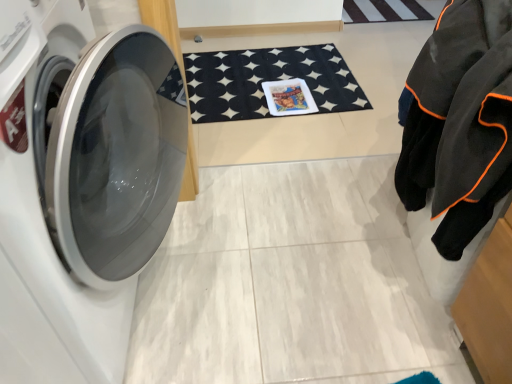
Image resolution: width=512 pixels, height=384 pixels. I want to click on black felt bath mat at center, so click(267, 81).

Measure the distance between point (465, 216) and camera.

A distance of 32.76 inches exists between point (465, 216) and camera.

Where is `black felt bath mat at center`? The image size is (512, 384). black felt bath mat at center is located at coordinates (267, 81).

Is black felt bath mat at center turned away from white glossy washing machine at left?

That's not correct — black felt bath mat at center is not looking away from white glossy washing machine at left.

Does point (236, 104) lie behind point (85, 185)?

Yes, point (236, 104) is farther from viewer.

Can you tell me how much black felt bath mat at center and white glossy washing machine at left differ in facing direction?

The angular difference between black felt bath mat at center and white glossy washing machine at left is 87.9 degrees.

From the image's perspective, which one is positioned lower, white glossy washing machine at left or black felt bath mat at center?

From the image's view, white glossy washing machine at left is below.

From the picture: Is white glossy washing machine at left not near black felt bath mat at center?

white glossy washing machine at left is far away from black felt bath mat at center.

Can you confirm if white glossy washing machine at left is positioned to the right of black felt bath mat at center?

In fact, white glossy washing machine at left is to the left of black felt bath mat at center.

Considering the positions of point (457, 42) and point (114, 88), is point (457, 42) closer or farther from the camera than point (114, 88)?

Clearly, point (457, 42) is closer to the camera than point (114, 88).

Is black fleece jacket at right positioned far away from white glossy washing machine at left?

No.

In the image, is black fleece jacket at right on the left side or the right side of white glossy washing machine at left?

From the image, it's evident that black fleece jacket at right is to the right of white glossy washing machine at left.

Is black fleece jacket at right situated inside white glossy washing machine at left or outside?

black fleece jacket at right is not enclosed by white glossy washing machine at left.

Does black felt bath mat at center have a lesser height compared to black fleece jacket at right?

Yes.

Is there a large distance between black felt bath mat at center and black fleece jacket at right?

Absolutely, black felt bath mat at center is distant from black fleece jacket at right.

Is black felt bath mat at center in front of or behind black fleece jacket at right in the image?

In the image, black felt bath mat at center appears behind black fleece jacket at right.

From a real-world perspective, is black fleece jacket at right positioned above or below black felt bath mat at center?

In terms of real-world spatial position, black fleece jacket at right is above black felt bath mat at center.

Between black fleece jacket at right and black felt bath mat at center, which one has larger width?

black felt bath mat at center is wider.

Looking at this image, which is more to the right, black fleece jacket at right or black felt bath mat at center?

Positioned to the right is black fleece jacket at right.

Is the surface of black fleece jacket at right in direct contact with black felt bath mat at center?

No, black fleece jacket at right is not beside black felt bath mat at center.

Consider the image. From a real-world perspective, who is located higher, white glossy washing machine at left or black fleece jacket at right?

black fleece jacket at right, from a real-world perspective.

Is point (118, 312) closer to camera compared to point (468, 155)?

No.

Is white glossy washing machine at left oriented towards black fleece jacket at right?

Yes, white glossy washing machine at left is aimed at black fleece jacket at right.

Which object is positioned more to the right, white glossy washing machine at left or black fleece jacket at right?

Positioned to the right is black fleece jacket at right.

Find the location of a particular element. This screenshot has width=512, height=384. washing machine below the black felt bath mat at center (from the image's perspective) is located at coordinates (80, 185).

Identify the location of bath mat beneath the white glossy washing machine at left (from a real-world perspective). Image resolution: width=512 pixels, height=384 pixels. (267, 81).

Based on their spatial positions, is black felt bath mat at center or white glossy washing machine at left closer to black fleece jacket at right?

white glossy washing machine at left is closer to black fleece jacket at right.

Considering their positions, is white glossy washing machine at left positioned closer to black fleece jacket at right than black felt bath mat at center?

white glossy washing machine at left is closer to black fleece jacket at right.

Which object lies nearer to the anchor point black felt bath mat at center, black fleece jacket at right or white glossy washing machine at left?

white glossy washing machine at left.

Considering their positions, is white glossy washing machine at left positioned further to black felt bath mat at center than black fleece jacket at right?

black fleece jacket at right lies further to black felt bath mat at center than the other object.

When comparing their distances from white glossy washing machine at left, does black fleece jacket at right or black felt bath mat at center seem closer?

black fleece jacket at right lies closer to white glossy washing machine at left than the other object.

From the image, which object appears to be farther from white glossy washing machine at left, black felt bath mat at center or black fleece jacket at right?

black felt bath mat at center lies further to white glossy washing machine at left than the other object.

At what (x,y) coordinates should I click in order to perform the action: click on clothing located between white glossy washing machine at left and black felt bath mat at center in the depth direction. Please return your answer as a coordinate pair (x, y). Looking at the image, I should click on (458, 125).